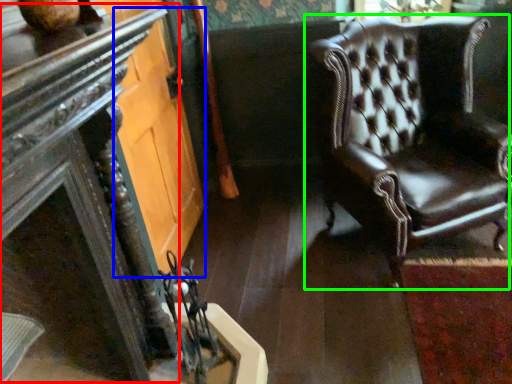
Question: Which object is the farthest from table (highlighted by a red box)? Choose among these: glass door (highlighted by a blue box) or chair (highlighted by a green box).

Choices:
 (A) glass door
 (B) chair

Answer: (B)